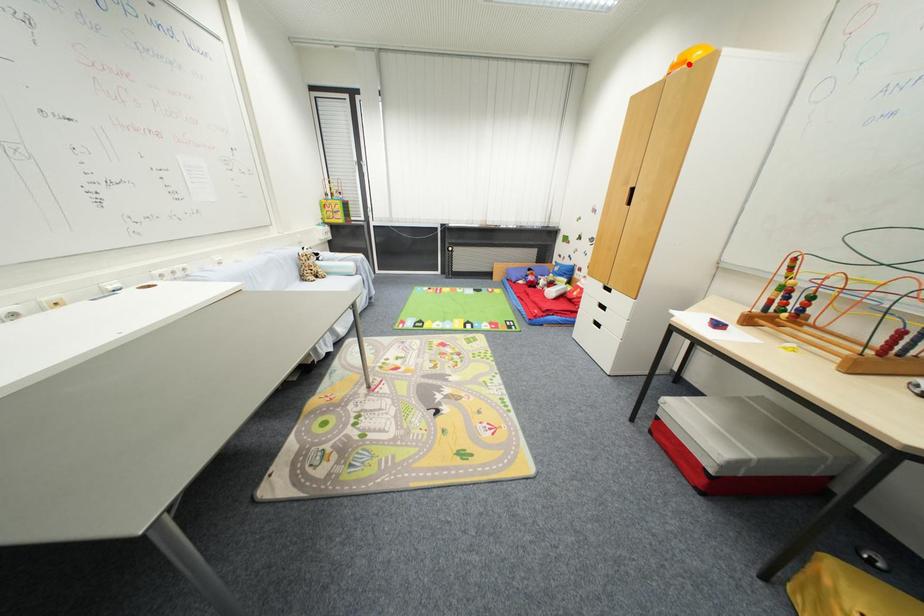
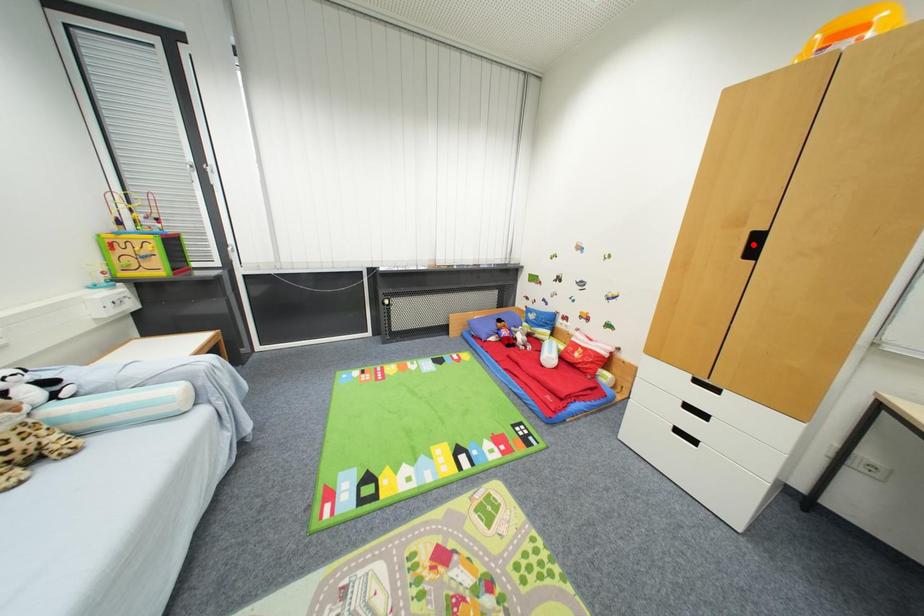
I am providing you with two images of the same scene from different viewpoints. A red point is marked on the first image and another point is marked on the second image. Are the points marked in image1 and image2 representing the same 3D position?

No